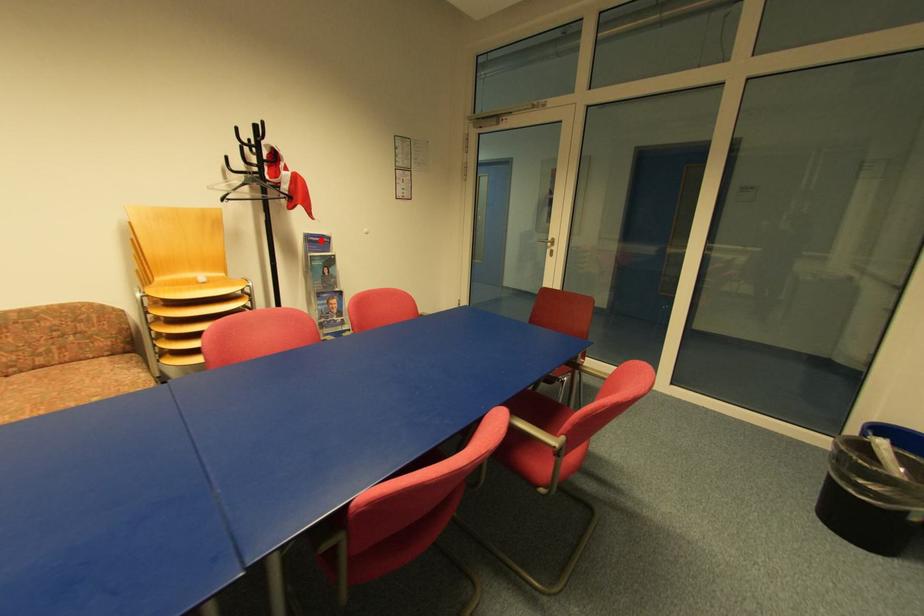
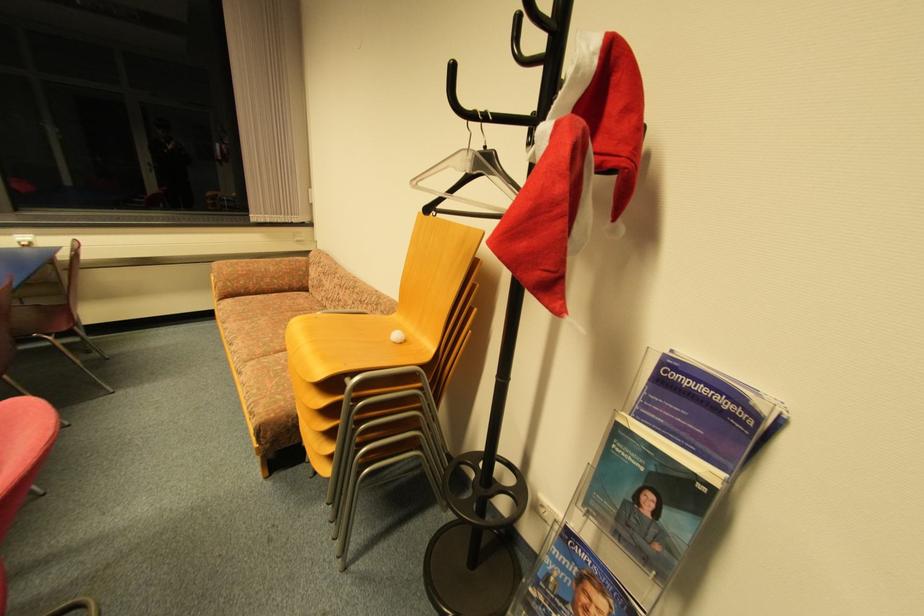
Find the pixel in the second image that matches the highlighted location in the first image.

(708, 391)